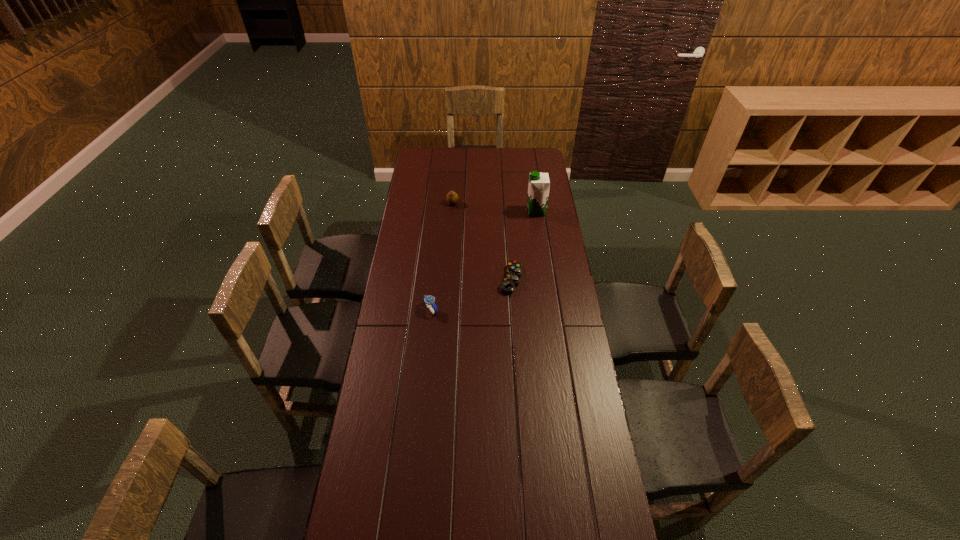
This screenshot has width=960, height=540. Identify the location of vacant area that lies between the watch and the second nearest object. (470, 294).

Image resolution: width=960 pixels, height=540 pixels. Identify the location of free space between the pear and the shortest object. (482, 241).

Where is `blank region between the nearest object and the tallest object`? The image size is (960, 540). blank region between the nearest object and the tallest object is located at coordinates (484, 260).

I want to click on vacant point located between the pear and the tallest object, so click(494, 207).

At what (x,y) coordinates should I click in order to perform the action: click on the closest object to the nearest object. Please return your answer as a coordinate pair (x, y). The height and width of the screenshot is (540, 960). Looking at the image, I should click on (511, 280).

Locate an element on the screen. object that is the third closest to the pear is located at coordinates (429, 300).